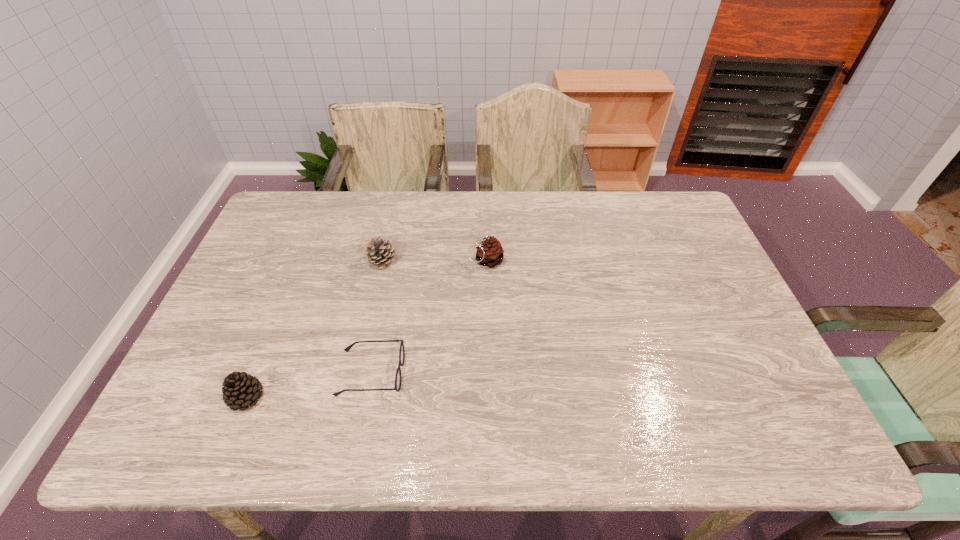
The width and height of the screenshot is (960, 540). Find the location of `the rightmost object`. the rightmost object is located at coordinates (490, 253).

At what (x,y) coordinates should I click in order to perform the action: click on the second pinecone from left to right. Please return your answer as a coordinate pair (x, y). The width and height of the screenshot is (960, 540). Looking at the image, I should click on (379, 253).

At what (x,y) coordinates should I click in order to perform the action: click on the nearest pinecone. Please return your answer as a coordinate pair (x, y). The height and width of the screenshot is (540, 960). Looking at the image, I should click on (241, 390).

Find the location of `the leftmost object`. the leftmost object is located at coordinates (241, 390).

The width and height of the screenshot is (960, 540). What are the coordinates of `the shortest object` in the screenshot? It's located at (398, 378).

Where is `vacant space located 0.080m with a leaf charm attached to the rightmost pinecone`? vacant space located 0.080m with a leaf charm attached to the rightmost pinecone is located at coordinates (442, 261).

In order to click on vacant space positioned with a leaf charm attached to the rightmost pinecone in this screenshot , I will do `click(342, 261)`.

Image resolution: width=960 pixels, height=540 pixels. Find the location of `vacant area situated with a leaf charm attached to the rightmost pinecone`. vacant area situated with a leaf charm attached to the rightmost pinecone is located at coordinates (338, 261).

Locate an element on the screen. The image size is (960, 540). vacant area situated on the right of the second pinecone from right to left is located at coordinates (464, 261).

You are a GUI agent. You are given a task and a screenshot of the screen. Output one action in this format:
    pyautogui.click(x=<x>, y=<y>)
    Task: Click on the vacant space located at the narrow end of the leftmost object
    
    Given the screenshot: What is the action you would take?
    coord(373,397)